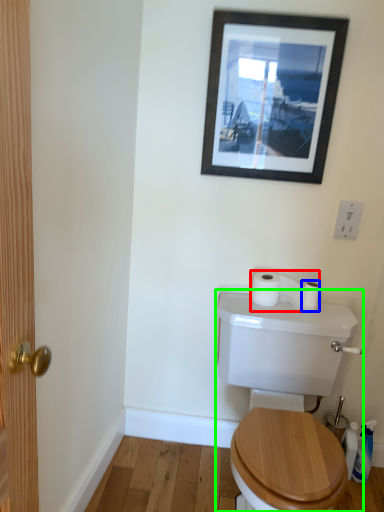
Question: Estimate the real-world distances between objects in this image. Which object is closer to toilet paper (highlighted by a red box), toilet paper (highlighted by a blue box) or toilet (highlighted by a green box)?

Choices:
 (A) toilet paper
 (B) toilet

Answer: (A)